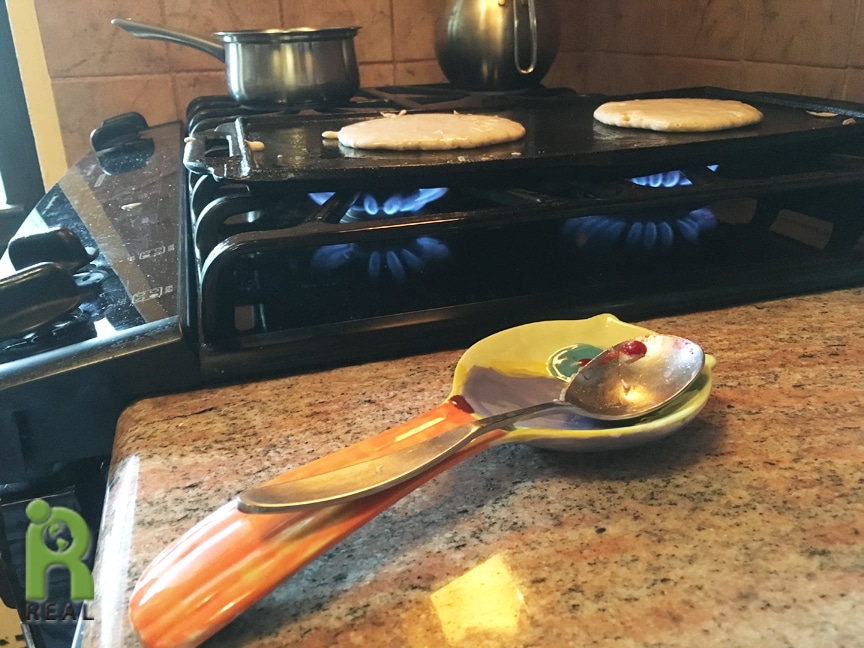
I want to click on stove burners, so click(397, 256), click(670, 229), click(300, 102), click(478, 95).